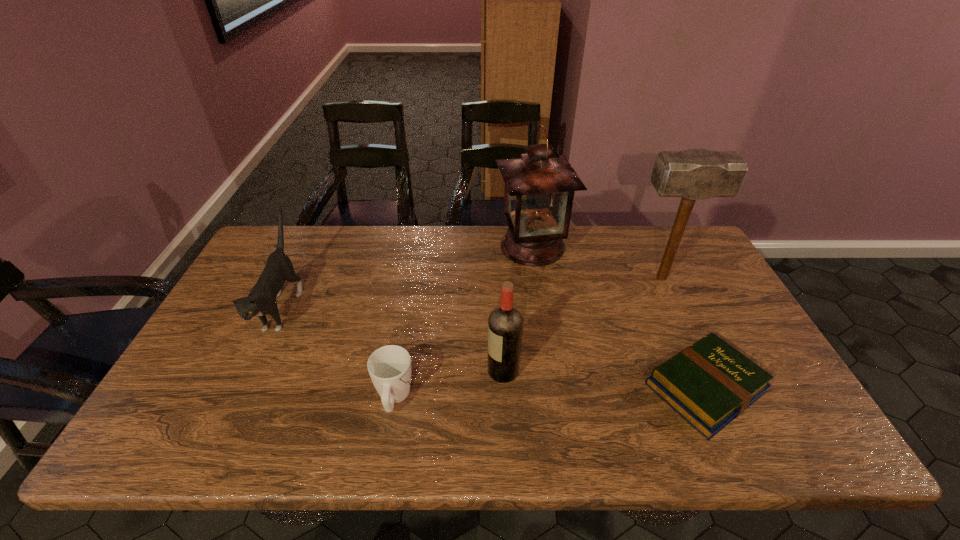
At what (x,y) coordinates should I click in order to perform the action: click on free spot that satisfies the following two spatial constraints: 1. on the front side of the oil lamp; 2. on the left side of the book. Please return your answer as a coordinate pair (x, y). This screenshot has width=960, height=540. Looking at the image, I should click on (553, 388).

This screenshot has width=960, height=540. Identify the location of free point that satisfies the following two spatial constraints: 1. at the face of the book; 2. on the left side of the fourth tallest object. (245, 388).

Locate an element on the screen. free space that satisfies the following two spatial constraints: 1. on the front-facing side of the fourth shortest object; 2. on the back side of the book is located at coordinates (504, 388).

I want to click on vacant region that satisfies the following two spatial constraints: 1. on the striking face of the mallet; 2. at the face of the leftmost object, so click(x=676, y=307).

Locate an element on the screen. free spot that satisfies the following two spatial constraints: 1. on the side of the shortest object with the handle; 2. on the left side of the second object from left to right is located at coordinates (396, 388).

In order to click on vacant region that satisfies the following two spatial constraints: 1. on the striking face of the mallet; 2. at the face of the cat in this screenshot , I will do `click(676, 307)`.